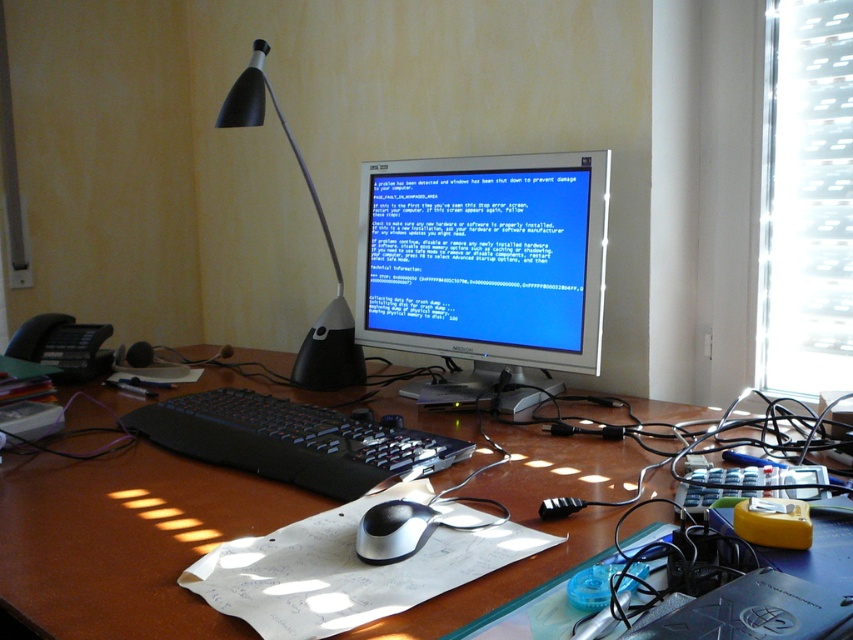
Is point (148, 440) more distant than point (305, 369)?

No.

Which is in front, point (251, 412) or point (254, 90)?

Positioned in front is point (251, 412).

Locate an element on the screen. Image resolution: width=853 pixels, height=640 pixels. black plastic keyboard at center is located at coordinates pos(291,440).

Is point (106, 442) more distant than point (343, 305)?

No, it is not.

Which of these two, brown wooden desk at center or black plastic desk lamp at upper center, stands taller?

black plastic desk lamp at upper center is taller.

This screenshot has width=853, height=640. Find the location of `brown wooden desk at center`. brown wooden desk at center is located at coordinates (126, 540).

Is black plastic desk lamp at upper center further to camera compared to sleek silver mouse at center?

Yes, it is.

Which is below, black plastic desk lamp at upper center or sleek silver mouse at center?

sleek silver mouse at center is lower down.

Locate an element on the screen. The width and height of the screenshot is (853, 640). black plastic desk lamp at upper center is located at coordinates (325, 241).